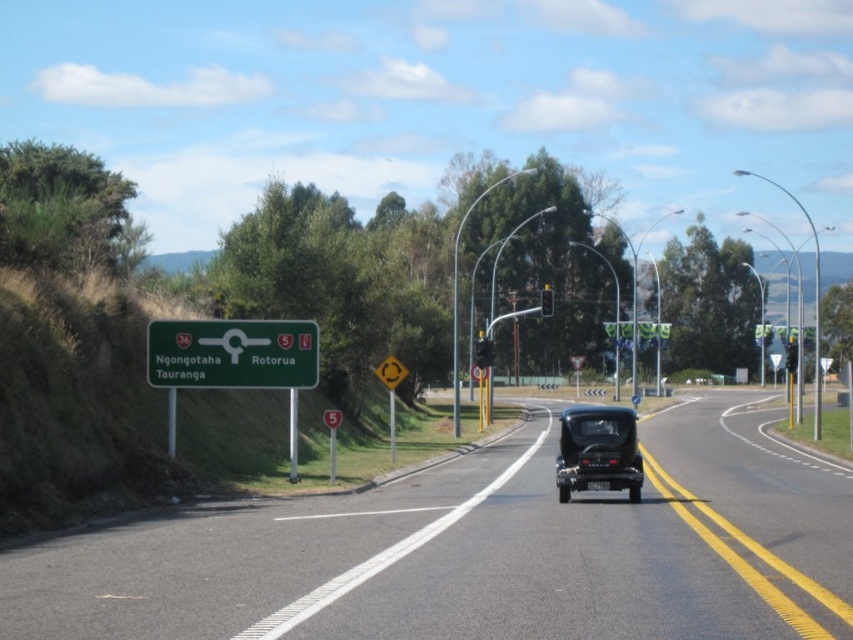
You are a driver approaching the road scene described. You need to reach Tauranga, which is 1 km away. There is a green matte sign at left located at point (231, 353). Can you determine the direction you should turn based on the sign?

The green matte sign at left located at point (231, 353) indicates that Tauranga is 1 km ahead, so you should continue straight ahead to reach Tauranga.